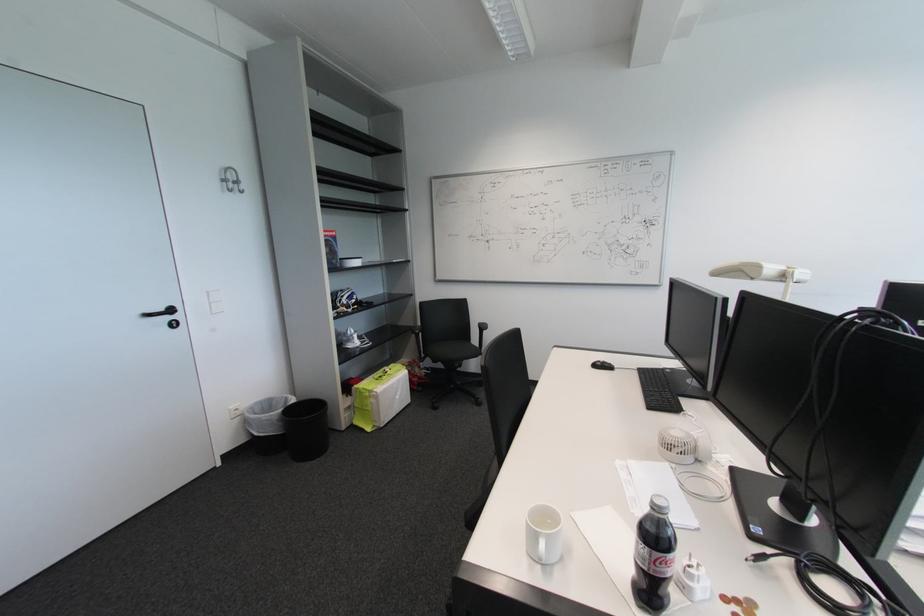
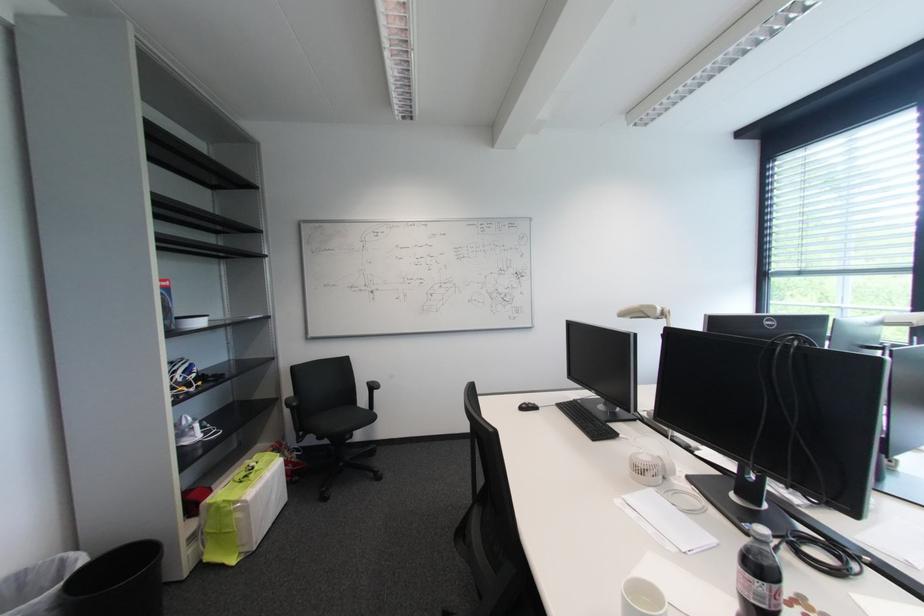
Where in the second image is the point corresponding to the point at 663,371 from the first image?

(578, 403)